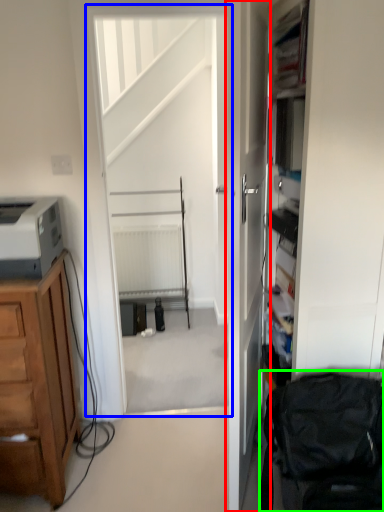
Question: Estimate the real-world distances between objects in this image. Which object is farther from door (highlighted by a red box), screen door (highlighted by a blue box) or swivel chair (highlighted by a green box)?

Choices:
 (A) screen door
 (B) swivel chair

Answer: (A)